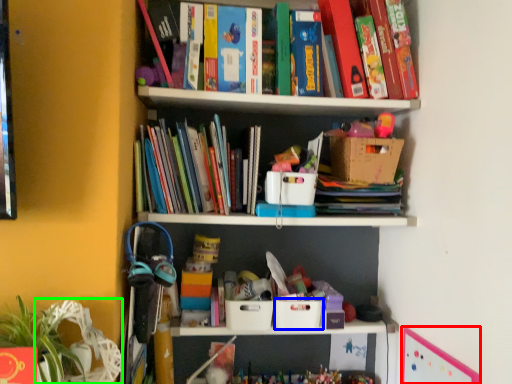
Question: Which object is positioned farthest from bulletin board (highlighted by a red box)? Select from storage box (highlighted by a blue box) and swivel chair (highlighted by a green box).

Choices:
 (A) storage box
 (B) swivel chair

Answer: (B)